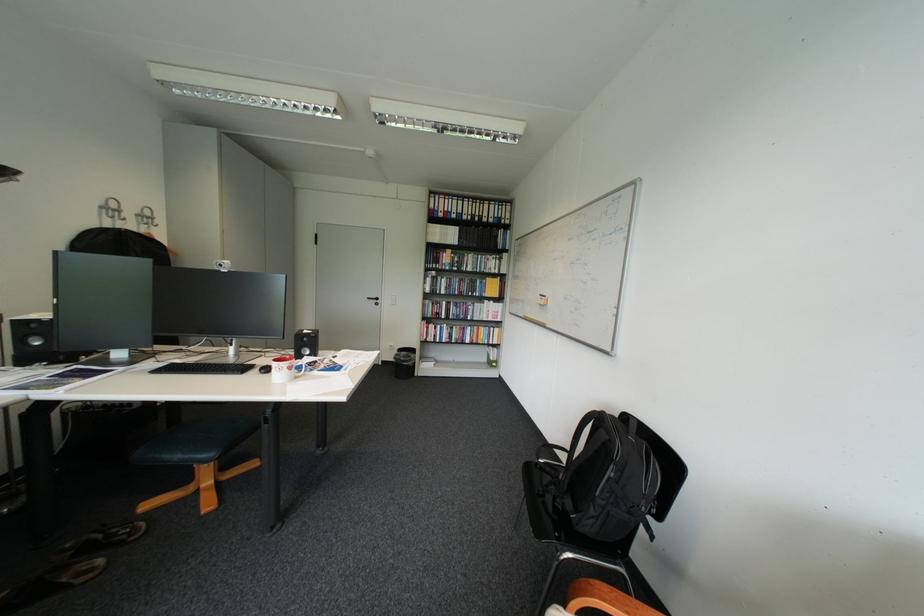
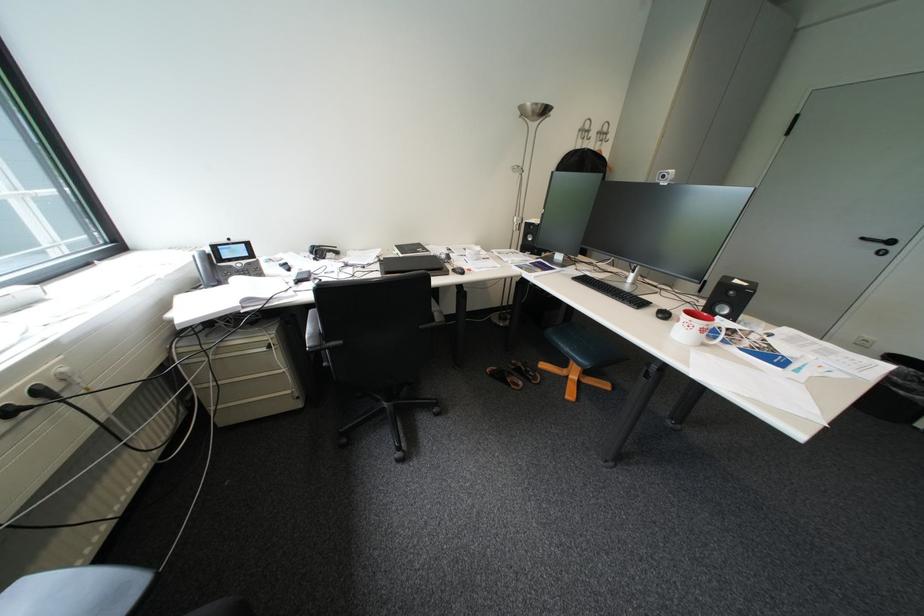
In the second image, find the point that corresponds to (93,565) in the first image.

(527, 379)